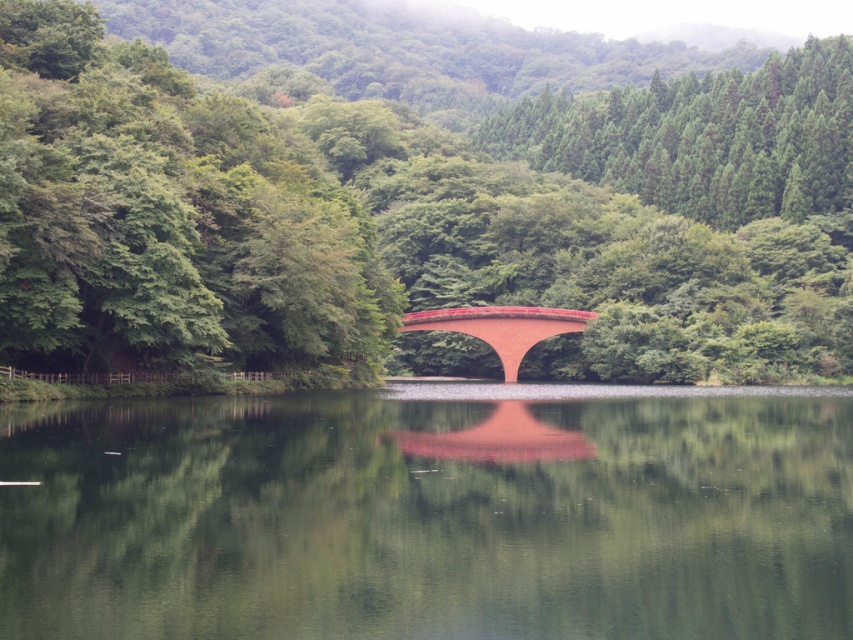
Can you confirm if green smooth water at center is smaller than smooth red bridge at center?

No, green smooth water at center is not smaller than smooth red bridge at center.

Find the location of a particular element. green smooth water at center is located at coordinates (427, 516).

Does point (583, 451) lie behind point (521, 305)?

No, it is in front of (521, 305).

Locate an element on the screen. green smooth water at center is located at coordinates (427, 516).

Who is taller, matte red bridge at center or smooth red bridge at center?

Standing taller between the two is matte red bridge at center.

Which is more to the left, matte red bridge at center or smooth red bridge at center?

From the viewer's perspective, matte red bridge at center appears more on the left side.

Between point (585, 36) and point (526, 308), which one is positioned behind?

Positioned behind is point (585, 36).

Find the location of a particular element. The image size is (853, 640). matte red bridge at center is located at coordinates (413, 211).

Does point (795, 248) come in front of point (555, 534)?

That is False.

This screenshot has width=853, height=640. Identify the location of matte red bridge at center. (413, 211).